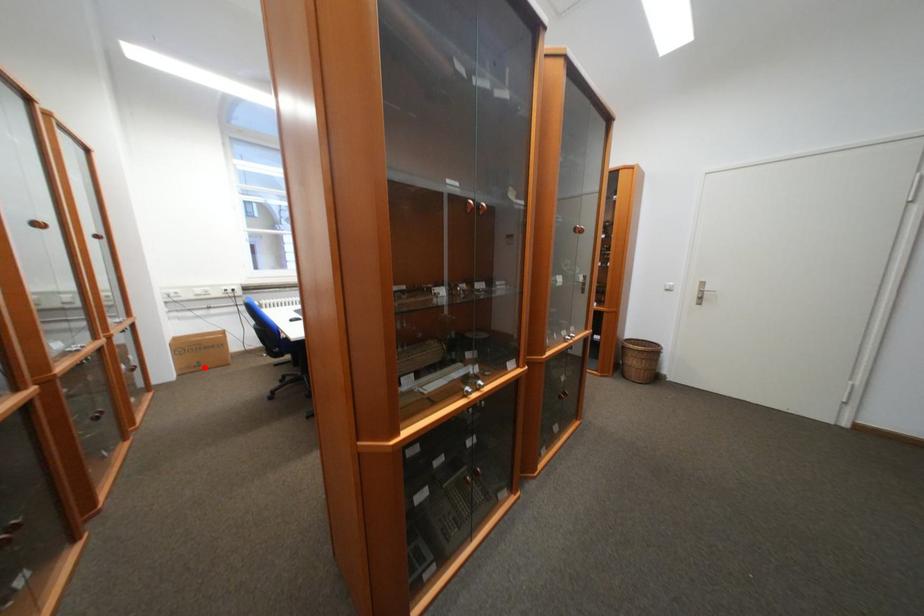
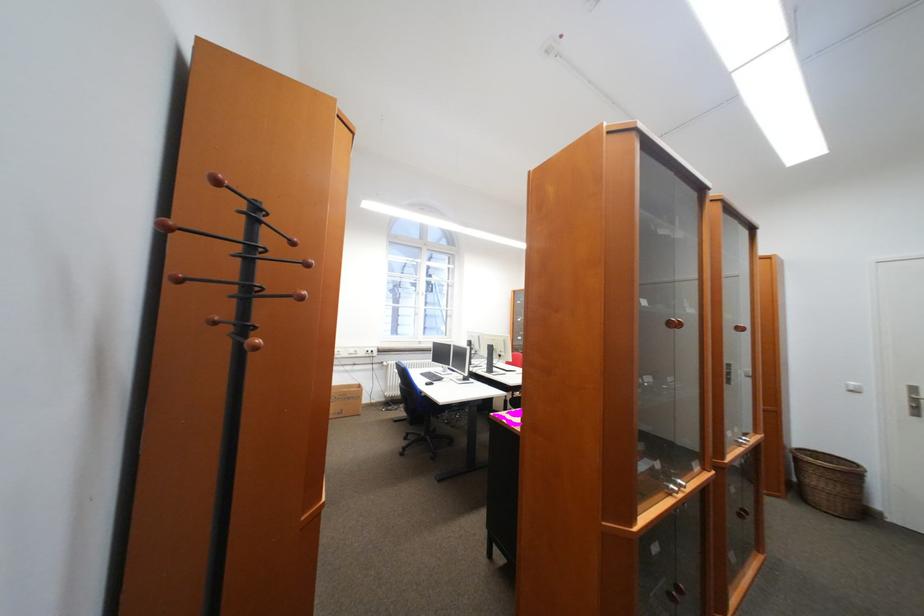
Find the pixel in the second image that matches the highlighted location in the first image.

(347, 415)